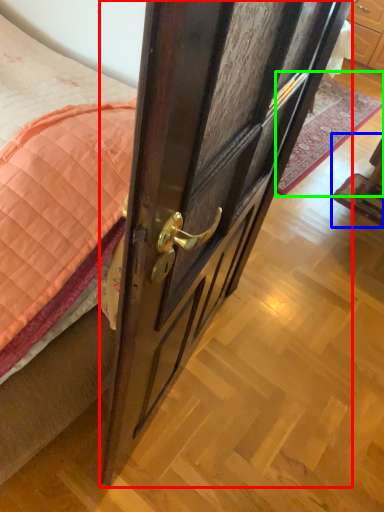
Question: Which is nearer to the door (highlighted by a red box)? furniture (highlighted by a blue box) or plain (highlighted by a green box).

Choices:
 (A) furniture
 (B) plain

Answer: (A)